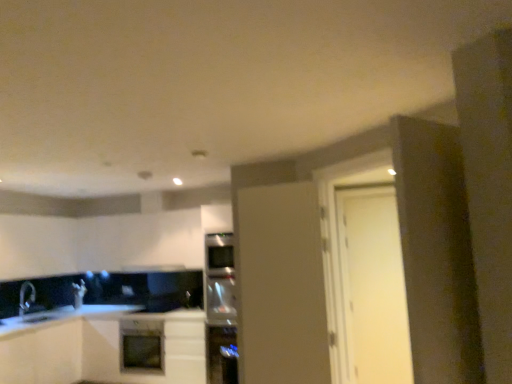
Question: Considering the relative positions of matte white oven at center and white matte cabinet at lower left, the first cabinetry viewed from the left, in the image provided, is matte white oven at center behind white matte cabinet at lower left, the first cabinetry viewed from the left,?

Choices:
 (A) no
 (B) yes

Answer: (B)

Question: Would you say matte white oven at center contains white matte cabinet at lower left, which is counted as the second cabinetry, starting from the right?

Choices:
 (A) no
 (B) yes

Answer: (A)

Question: Considering the relative positions of matte white oven at center and white matte cabinet at lower left, which is counted as the second cabinetry, starting from the right, in the image provided, is matte white oven at center in front of white matte cabinet at lower left, which is counted as the second cabinetry, starting from the right,?

Choices:
 (A) no
 (B) yes

Answer: (A)

Question: Is matte white oven at center far from white matte cabinet at lower left, which is counted as the second cabinetry, starting from the right?

Choices:
 (A) yes
 (B) no

Answer: (B)

Question: Is matte white oven at center taller than white matte cabinet at lower left, which is counted as the second cabinetry, starting from the right?

Choices:
 (A) no
 (B) yes

Answer: (A)

Question: Does matte white oven at center turn towards white matte cabinet at lower left, the first cabinetry viewed from the left?

Choices:
 (A) yes
 (B) no

Answer: (B)

Question: From a real-world perspective, is white matte door at right, arranged as the 1th door when viewed from the back, over black matte exhaust hood at center?

Choices:
 (A) no
 (B) yes

Answer: (A)

Question: Considering the relative positions of white matte door at right, which ranks as the second door in left-to-right order, and black matte exhaust hood at center in the image provided, is white matte door at right, which ranks as the second door in left-to-right order, to the right of black matte exhaust hood at center from the viewer's perspective?

Choices:
 (A) no
 (B) yes

Answer: (B)

Question: Is white matte door at right, which ranks as the second door in left-to-right order, turned away from black matte exhaust hood at center?

Choices:
 (A) yes
 (B) no

Answer: (B)

Question: Considering the relative sizes of white matte door at right, arranged as the 1th door when viewed from the back, and black matte exhaust hood at center in the image provided, is white matte door at right, arranged as the 1th door when viewed from the back, thinner than black matte exhaust hood at center?

Choices:
 (A) no
 (B) yes

Answer: (B)

Question: Is there a large distance between white matte door at right, the first door in the right-to-left sequence, and black matte exhaust hood at center?

Choices:
 (A) no
 (B) yes

Answer: (B)

Question: Considering the relative sizes of white matte door at right, marked as the second door in a front-to-back arrangement, and black matte exhaust hood at center in the image provided, is white matte door at right, marked as the second door in a front-to-back arrangement, smaller than black matte exhaust hood at center?

Choices:
 (A) no
 (B) yes

Answer: (A)

Question: Is white matte cabinet at center, positioned as the 1th cabinetry in right-to-left order, smaller than black matte exhaust hood at center?

Choices:
 (A) yes
 (B) no

Answer: (B)